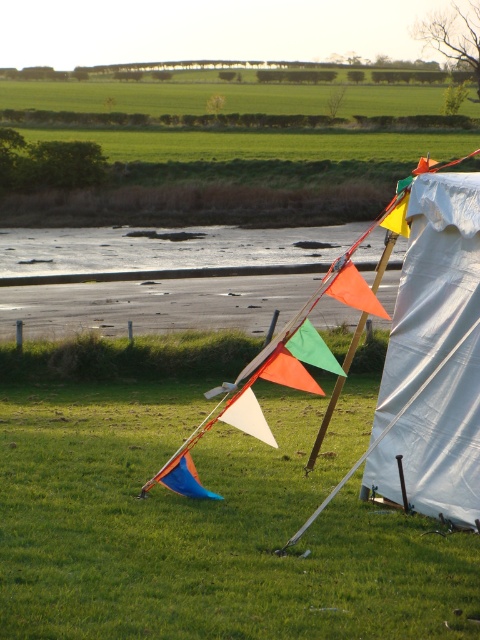
Is point (269, 499) positioned before point (392, 419)?

No, (269, 499) is further to viewer.

How distant is green grass at center from white fabric tent at right?

green grass at center is 2.29 meters from white fabric tent at right.

The width and height of the screenshot is (480, 640). In order to click on green grass at center in this screenshot , I will do `click(208, 525)`.

Identify the location of green grass at center. The image size is (480, 640). (208, 525).

Is green grass at center smaller than orange fabric kite at center?

Yes, green grass at center is smaller than orange fabric kite at center.

Is the position of green grass at center less distant than that of orange fabric kite at center?

Yes, it is in front of orange fabric kite at center.

Between point (2, 417) and point (231, 419), which one is positioned behind?

The point (2, 417) is more distant.

This screenshot has height=640, width=480. Find the location of `green grass at center`. green grass at center is located at coordinates (208, 525).

Is point (385, 419) closer to viewer compared to point (288, 376)?

No.

You are a GUI agent. You are given a task and a screenshot of the screen. Output one action in this format:
    pyautogui.click(x=<x>, y=<y>)
    Task: Click on the white fabric tent at right
    
    Given the screenshot: What is the action you would take?
    pyautogui.click(x=433, y=356)

What do you see at coordinates (433, 356) in the screenshot? The image size is (480, 640). I see `white fabric tent at right` at bounding box center [433, 356].

I want to click on white fabric tent at right, so click(433, 356).